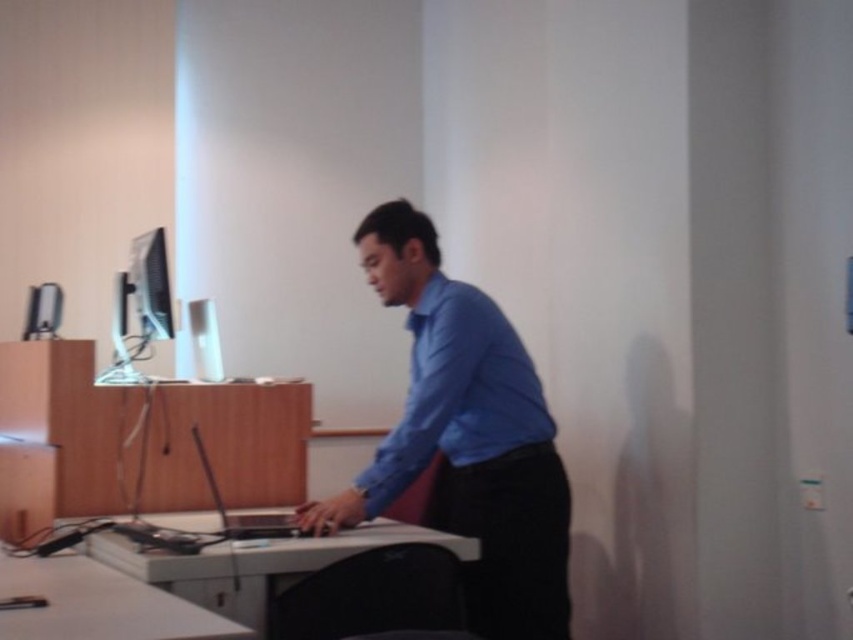
Question: From the image, what is the correct spatial relationship of blue smooth shirt at center in relation to matte black monitor at left?

Choices:
 (A) right
 (B) left

Answer: (A)

Question: Estimate the real-world distances between objects in this image. Which object is closer to the white glossy computer desk at center?

Choices:
 (A) matte black monitor at left
 (B) blue smooth shirt at center
 (C) blue smooth dress shirt at center

Answer: (B)

Question: Which point is farther to the camera?

Choices:
 (A) white glossy computer desk at center
 (B) blue smooth dress shirt at center
 (C) blue smooth shirt at center
 (D) matte black monitor at left

Answer: (D)

Question: Which point is closer to the camera taking this photo?

Choices:
 (A) (474, 376)
 (B) (521, 424)

Answer: (A)

Question: Is blue smooth dress shirt at center positioned in front of white glossy computer desk at center?

Choices:
 (A) no
 (B) yes

Answer: (A)

Question: From the image, what is the correct spatial relationship of blue smooth dress shirt at center in relation to white glossy computer desk at center?

Choices:
 (A) right
 (B) left

Answer: (A)